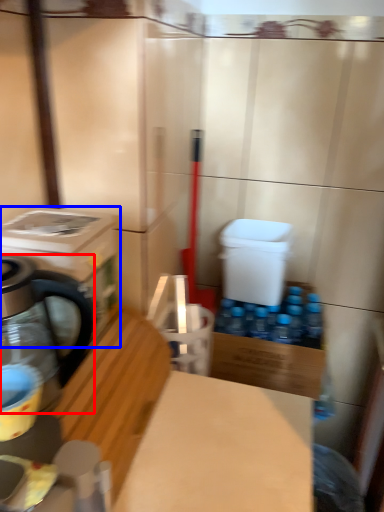
Question: Which of the following is the closest to the observer, kitchen appliance (highlighted by a red box) or washing machine (highlighted by a blue box)?

Choices:
 (A) kitchen appliance
 (B) washing machine

Answer: (A)